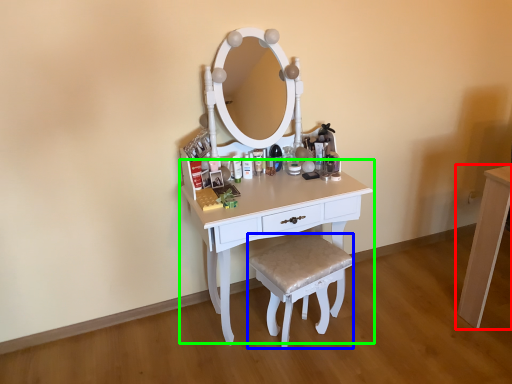
Question: Based on their relative distances, which object is farther from table (highlighted by a red box)? Choose from stool (highlighted by a blue box) and table (highlighted by a green box).

Choices:
 (A) stool
 (B) table

Answer: (B)